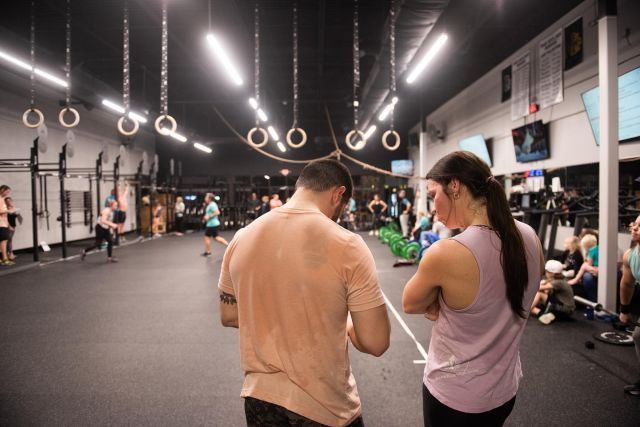
You are a GUI agent. You are given a task and a screenshot of the screen. Output one action in this format:
    pyautogui.click(x=<x>, y=<y>)
    Task: Click on the large white poster
    
    Given the screenshot: What is the action you would take?
    (x=518, y=86), (x=553, y=78)